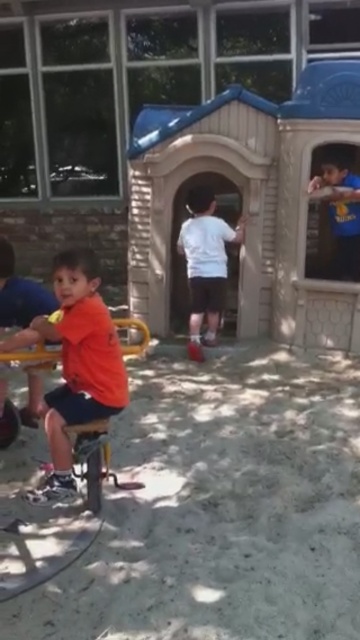
Does orange matte shirt at left have a smaller size compared to blue matte shirt at upper right?

Correct, orange matte shirt at left occupies less space than blue matte shirt at upper right.

Does orange matte shirt at left have a greater height compared to blue matte shirt at upper right?

Yes.

What do you see at coordinates (78, 364) in the screenshot?
I see `orange matte shirt at left` at bounding box center [78, 364].

Where is `orange matte shirt at left`? orange matte shirt at left is located at coordinates (78, 364).

Is white matte shirt at center to the left of blue matte shirt at upper right from the viewer's perspective?

Correct, you'll find white matte shirt at center to the left of blue matte shirt at upper right.

Find the location of a particular element. white matte shirt at center is located at coordinates (205, 264).

What do you see at coordinates (205, 264) in the screenshot? I see `white matte shirt at center` at bounding box center [205, 264].

At what (x,y) coordinates should I click in order to perform the action: click on white matte shirt at center. Please return your answer as a coordinate pair (x, y). Image resolution: width=360 pixels, height=640 pixels. Looking at the image, I should click on (205, 264).

Can you confirm if blue matte shirt at upper right is positioned below orange matte shirt at lower left?

No.

Which of these two, blue matte shirt at upper right or orange matte shirt at lower left, stands taller?

With more height is blue matte shirt at upper right.

Does point (344, 248) come closer to viewer compared to point (12, 301)?

No, it is not.

You are a GUI agent. You are given a task and a screenshot of the screen. Output one action in this format:
    pyautogui.click(x=<x>, y=<y>)
    Task: Click on the blue matte shirt at upper right
    
    Given the screenshot: What is the action you would take?
    pyautogui.click(x=336, y=214)